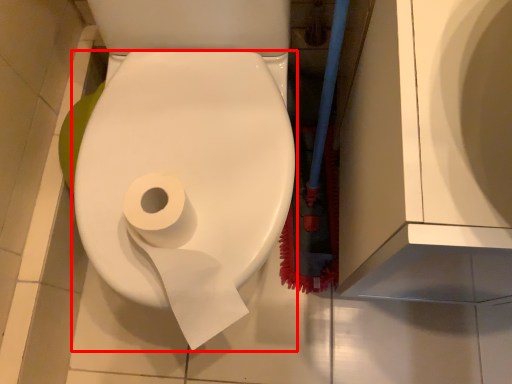
Question: Where is toilet paper (annotated by the red box) located in relation to toilet paper in the image?

Choices:
 (A) right
 (B) left

Answer: (A)